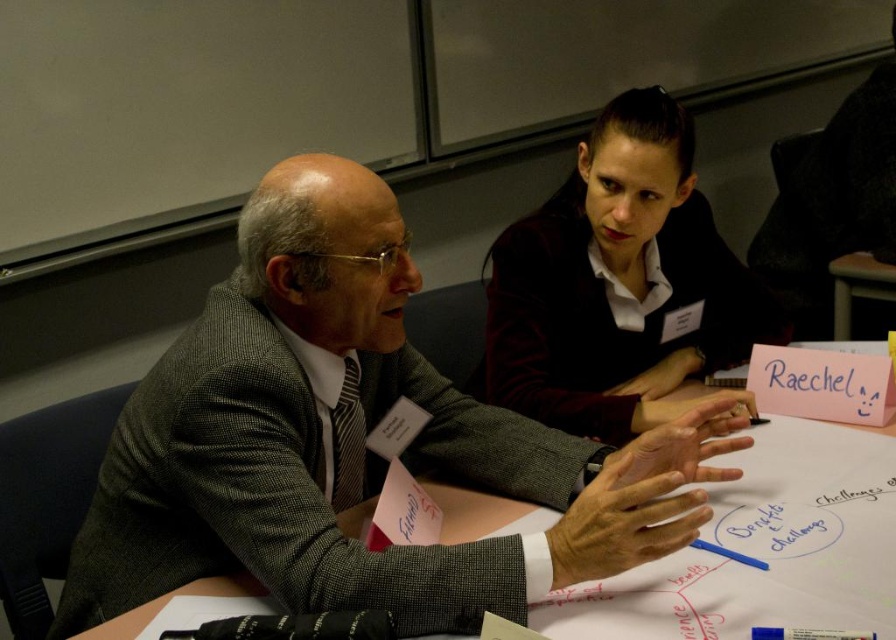
Is gray wool suit at center to the left of maroon fabric shirt at upper right from the viewer's perspective?

Yes, gray wool suit at center is to the left of maroon fabric shirt at upper right.

Can you confirm if gray wool suit at center is positioned above maroon fabric shirt at upper right?

No, gray wool suit at center is not above maroon fabric shirt at upper right.

Which is in front, point (319, 488) or point (673, 136)?

Point (319, 488)

I want to click on gray wool suit at center, so click(x=352, y=442).